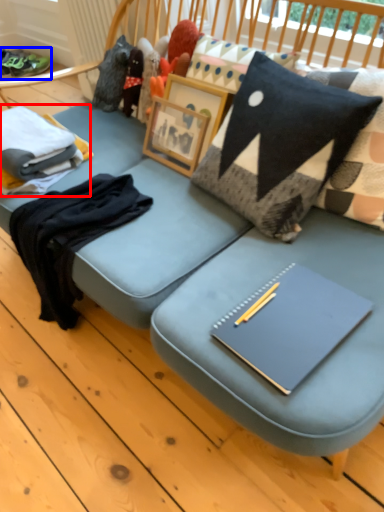
Question: Among these objects, which one is nearest to the camera, clothing (highlighted by a red box) or footwear (highlighted by a blue box)?

Choices:
 (A) clothing
 (B) footwear

Answer: (A)